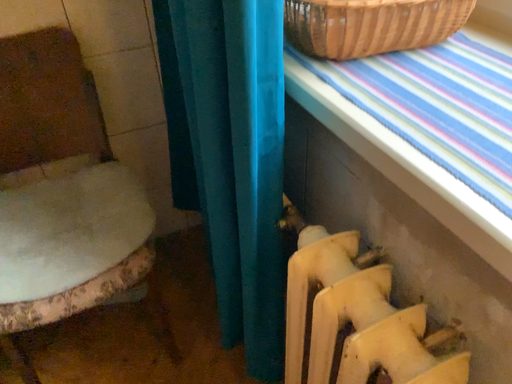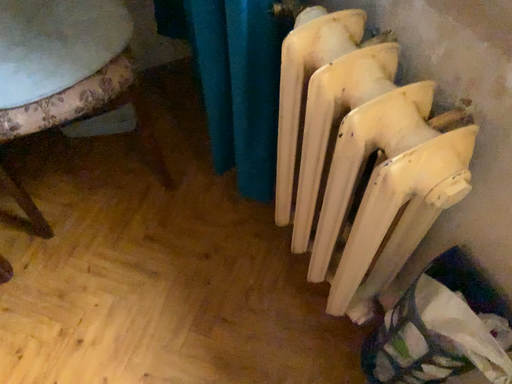
Question: How did the camera likely rotate when shooting the video?

Choices:
 (A) rotated downward
 (B) rotated upward

Answer: (A)